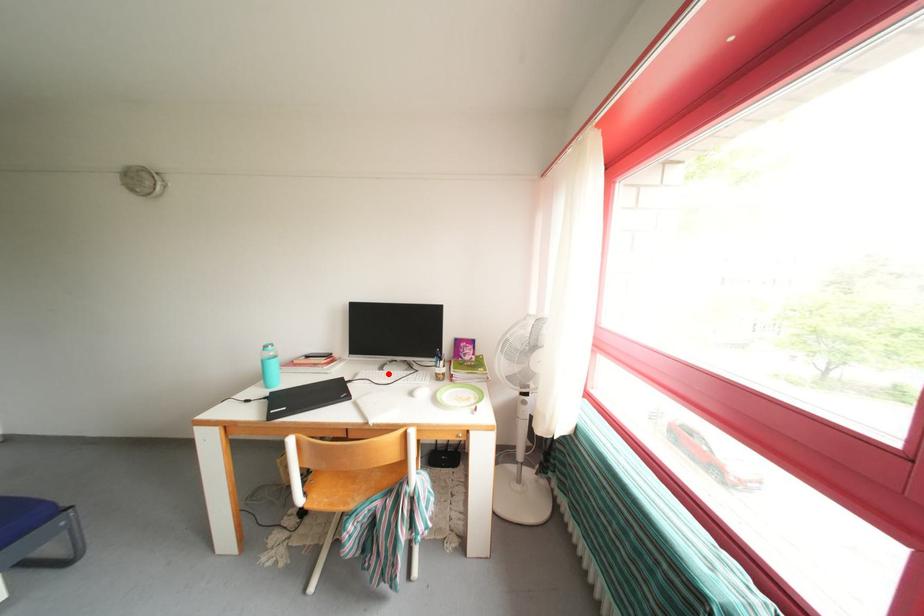
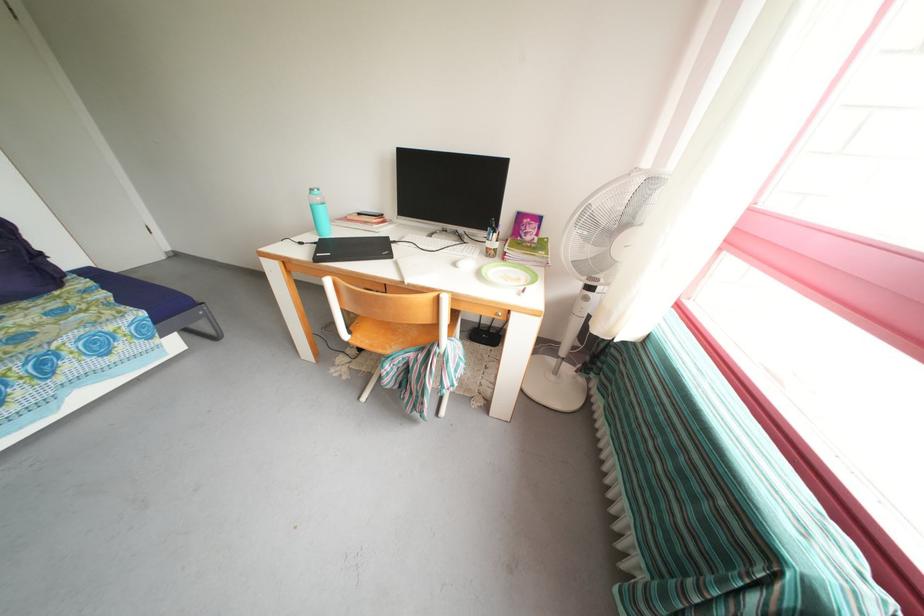
Locate, in the second image, the point that corresponds to the highlighted location in the first image.

(436, 241)